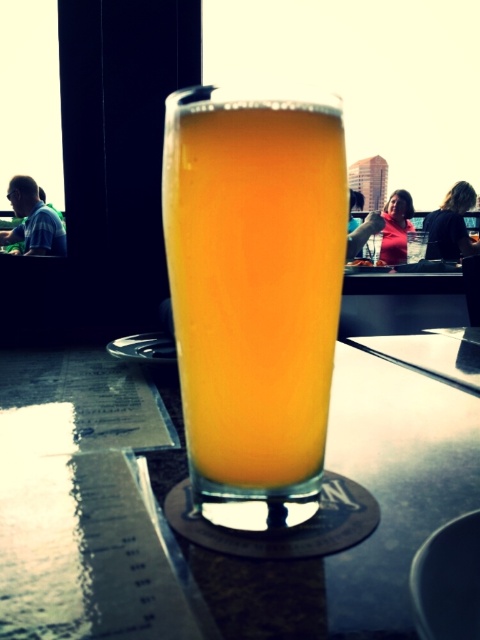
You are at a bar and want to choose a drink. You see a transparent glass at center and a translucent glass beer at center. Which one has a wider opening?

The transparent glass at center has a wider opening than the translucent glass beer at center because its width is larger.

You are a bartender who needs to place a coaster under both the transparent glass at center and the translucent glass beer at center. Which glass should you place the coaster under first to ensure it stays visible?

The transparent glass at center is in front of the translucent glass beer at center, so you should place the coaster under the translucent glass beer at center first to ensure it stays visible.

You are holding a camera and want to take a photo of the transparent glass at center. If your camera can focus on objects up to 15 centimeters away, will it be able to capture the glass clearly?

The transparent glass at center and camera are 14.27 centimeters apart from each other, which is within the camera focus range of up to 15 centimeters. Therefore, the camera can capture the glass clearly.